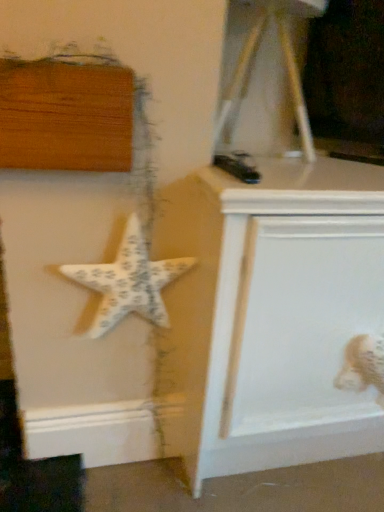
Question: Does white fabric toy at lower right have a lesser height compared to white textured starfish at center-left?

Choices:
 (A) no
 (B) yes

Answer: (B)

Question: Would you consider white fabric toy at lower right to be distant from white textured starfish at center-left?

Choices:
 (A) no
 (B) yes

Answer: (A)

Question: From the image's perspective, is white fabric toy at lower right below white textured starfish at center-left?

Choices:
 (A) no
 (B) yes

Answer: (B)

Question: Considering the relative positions of white fabric toy at lower right and white textured starfish at center-left in the image provided, is white fabric toy at lower right in front of white textured starfish at center-left?

Choices:
 (A) yes
 (B) no

Answer: (B)

Question: Is white fabric toy at lower right at the right side of white textured starfish at center-left?

Choices:
 (A) yes
 (B) no

Answer: (A)

Question: Is white fabric toy at lower right turned away from white textured starfish at center-left?

Choices:
 (A) yes
 (B) no

Answer: (B)

Question: From the image's perspective, is white painted wood vanity at center above white fabric toy at lower right?

Choices:
 (A) yes
 (B) no

Answer: (A)

Question: Is white painted wood vanity at center at the right side of white fabric toy at lower right?

Choices:
 (A) yes
 (B) no

Answer: (B)

Question: Does white painted wood vanity at center have a smaller size compared to white fabric toy at lower right?

Choices:
 (A) no
 (B) yes

Answer: (A)

Question: Is white painted wood vanity at center oriented away from white fabric toy at lower right?

Choices:
 (A) no
 (B) yes

Answer: (B)

Question: From a real-world perspective, does white painted wood vanity at center stand above white fabric toy at lower right?

Choices:
 (A) no
 (B) yes

Answer: (A)

Question: Is white painted wood vanity at center behind white fabric toy at lower right?

Choices:
 (A) yes
 (B) no

Answer: (B)

Question: Can you confirm if white textured starfish at center-left is positioned to the left of white painted wood vanity at center?

Choices:
 (A) no
 (B) yes

Answer: (B)